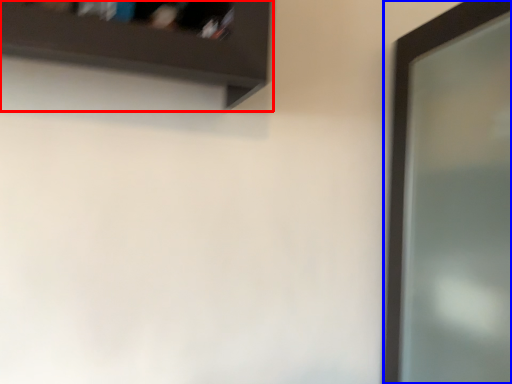
Question: Which object appears farthest to the camera in this image, shelf (highlighted by a red box) or screen door (highlighted by a blue box)?

Choices:
 (A) shelf
 (B) screen door

Answer: (B)